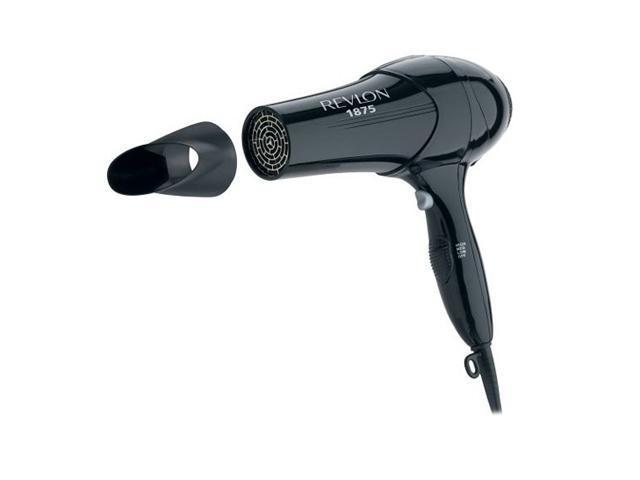
The height and width of the screenshot is (480, 640). What are the coordinates of `hair dryer diffuser attachment` in the screenshot? It's located at (219, 141).